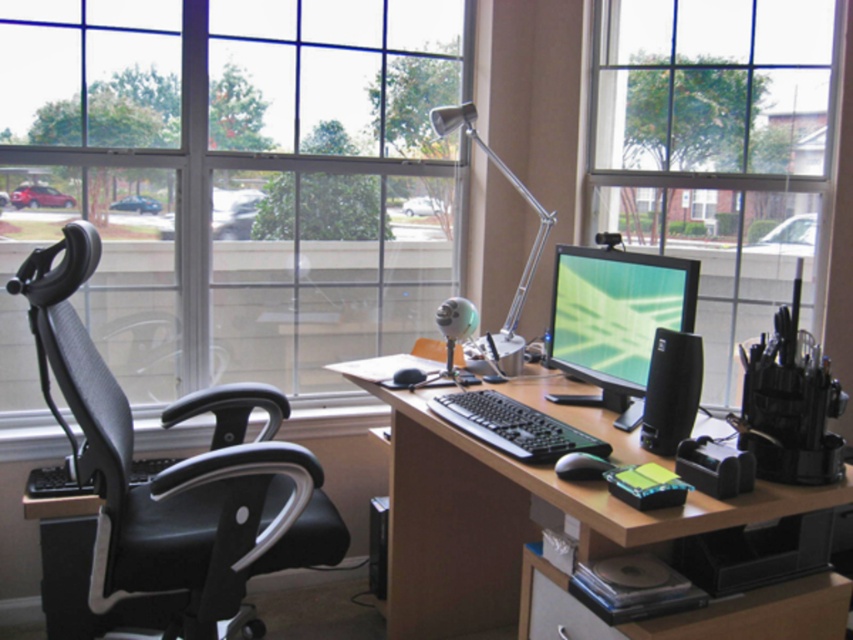
Does point (102, 467) come in front of point (555, 352)?

Yes, it is in front of point (555, 352).

Looking at this image, is black mesh swivel chair at left thinner than matte black monitor at center?

In fact, black mesh swivel chair at left might be wider than matte black monitor at center.

Between point (225, 525) and point (628, 321), which one is positioned behind?

The point (628, 321) is behind.

Where is `black mesh swivel chair at left`? black mesh swivel chair at left is located at coordinates (173, 468).

Which is in front, point (223, 269) or point (695, 298)?

Point (695, 298) is in front.

Who is lower down, transparent glass window at center or matte black monitor at center?

matte black monitor at center

Between point (412, 317) and point (583, 275), which one is positioned behind?

Point (412, 317)

Identify the location of transparent glass window at center. The height and width of the screenshot is (640, 853). (235, 177).

What do you see at coordinates (724, 148) in the screenshot? I see `clear glass window at upper right` at bounding box center [724, 148].

Is clear glass window at upper right bigger than brown wood computer desk at center?

No, clear glass window at upper right is not bigger than brown wood computer desk at center.

Based on the photo, measure the distance between point (793, 200) and camera.

9.70 feet

I want to click on clear glass window at upper right, so click(724, 148).